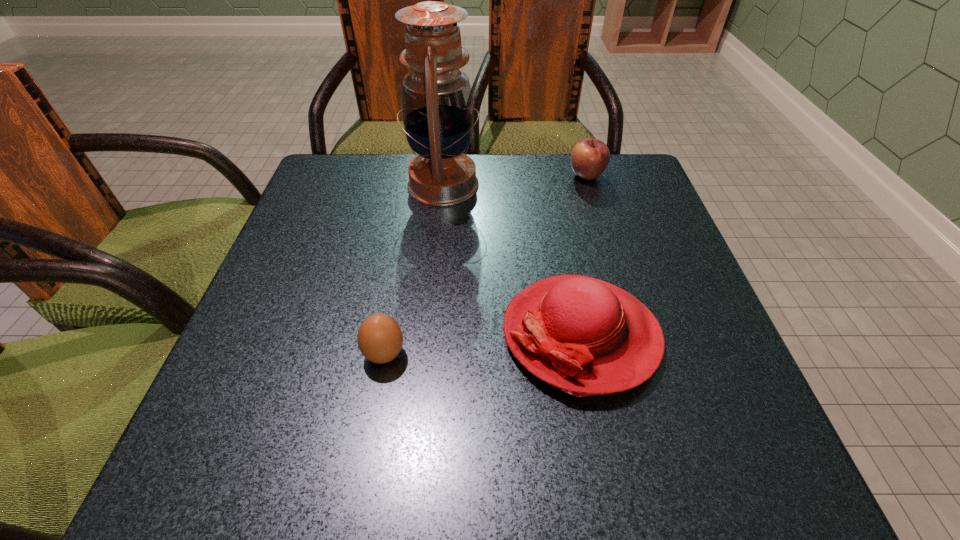
You are a GUI agent. You are given a task and a screenshot of the screen. Output one action in this format:
    pyautogui.click(x=<x>, y=<y>)
    Task: Click on the object that can be found as the closest to the boiled egg
    Image resolution: width=960 pixels, height=540 pixels.
    Given the screenshot: What is the action you would take?
    pyautogui.click(x=582, y=335)

This screenshot has width=960, height=540. I want to click on free space that satisfies the following two spatial constraints: 1. at the front of the hat with a bow; 2. on the front side of the boiled egg, so click(585, 354).